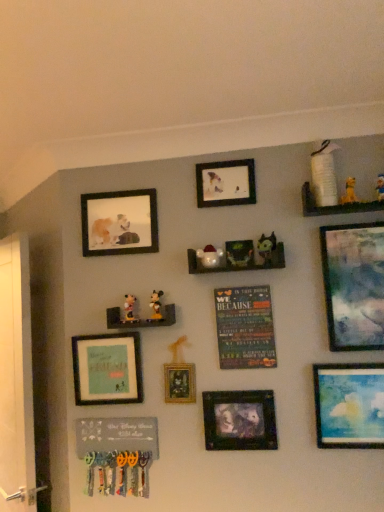
Question: Is matte black picture frame at upper center, arranged as the fourth picture frame when viewed from the right, placed right next to wooden shelf at center, which is the 2th shelf in left-to-right order?

Choices:
 (A) no
 (B) yes

Answer: (A)

Question: From a real-world perspective, is matte black picture frame at upper center, the fourth picture frame from the left, below wooden shelf at center, the second shelf viewed from the right?

Choices:
 (A) no
 (B) yes

Answer: (A)

Question: Considering the relative positions of matte black picture frame at upper center, arranged as the fourth picture frame when viewed from the right, and wooden shelf at center, which is the 2th shelf in left-to-right order, in the image provided, is matte black picture frame at upper center, arranged as the fourth picture frame when viewed from the right, to the left of wooden shelf at center, which is the 2th shelf in left-to-right order, from the viewer's perspective?

Choices:
 (A) yes
 (B) no

Answer: (A)

Question: Can you confirm if matte black picture frame at upper center, arranged as the fourth picture frame when viewed from the right, is thinner than wooden shelf at center, which appears as the 2th shelf when viewed from the top?

Choices:
 (A) no
 (B) yes

Answer: (B)

Question: Considering the relative positions of matte black picture frame at upper center, the fourth picture frame from the left, and wooden shelf at center, which appears as the 2th shelf when viewed from the top, in the image provided, is matte black picture frame at upper center, the fourth picture frame from the left, in front of wooden shelf at center, which appears as the 2th shelf when viewed from the top,?

Choices:
 (A) yes
 (B) no

Answer: (B)

Question: From a real-world perspective, is matte black picture frame at upper center, arranged as the fourth picture frame when viewed from the right, physically above wooden shelf at center, which is the 2th shelf in left-to-right order?

Choices:
 (A) yes
 (B) no

Answer: (A)

Question: Does matte green plush toy at upper center, which is counted as the 4th toy, starting from the left, have a larger size compared to yellow plush toy at upper right, which is the fifth toy from left to right?

Choices:
 (A) yes
 (B) no

Answer: (A)

Question: Is matte green plush toy at upper center, marked as the 3th toy in a right-to-left arrangement, touching yellow plush toy at upper right, the fifth toy ordered from the bottom?

Choices:
 (A) no
 (B) yes

Answer: (A)

Question: From the image's perspective, is matte green plush toy at upper center, which is counted as the 4th toy, starting from the left, over yellow plush toy at upper right, positioned as the second toy in right-to-left order?

Choices:
 (A) yes
 (B) no

Answer: (B)

Question: Considering the relative sizes of matte green plush toy at upper center, which appears as the 3th toy when viewed from the top, and yellow plush toy at upper right, which is the fifth toy from left to right, in the image provided, is matte green plush toy at upper center, which appears as the 3th toy when viewed from the top, thinner than yellow plush toy at upper right, which is the fifth toy from left to right,?

Choices:
 (A) no
 (B) yes

Answer: (A)

Question: Is yellow plush toy at upper right, positioned as the second toy in right-to-left order, completely or partially inside matte green plush toy at upper center, marked as the 3th toy in a right-to-left arrangement?

Choices:
 (A) no
 (B) yes

Answer: (A)

Question: From a real-world perspective, is matte green plush toy at upper center, which is counted as the 4th toy, starting from the left, positioned over yellow plush toy at upper right, the fifth toy ordered from the bottom, based on gravity?

Choices:
 (A) yes
 (B) no

Answer: (B)

Question: From a real-world perspective, is matte plastic santa at center, which ranks as the third toy in bottom-to-top order, located beneath matte wooden picture frame at upper left, positioned as the 2th picture frame in left-to-right order?

Choices:
 (A) yes
 (B) no

Answer: (A)